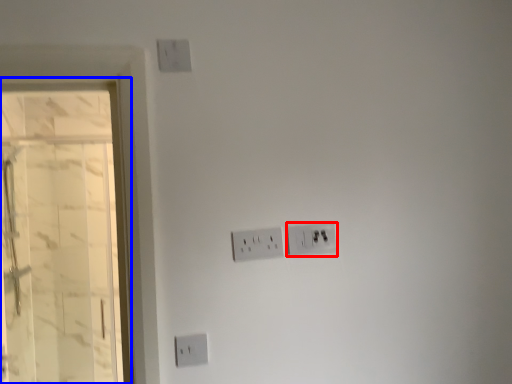
Question: Among these objects, which one is nearest to the camera, power plugs and sockets (highlighted by a red box) or glass door (highlighted by a blue box)?

Choices:
 (A) power plugs and sockets
 (B) glass door

Answer: (A)